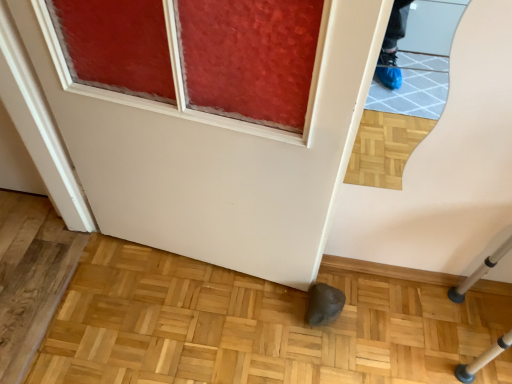
Where is `vacant area to the left of silver metallic crutch at lower right`? Image resolution: width=512 pixels, height=384 pixels. vacant area to the left of silver metallic crutch at lower right is located at coordinates (412, 332).